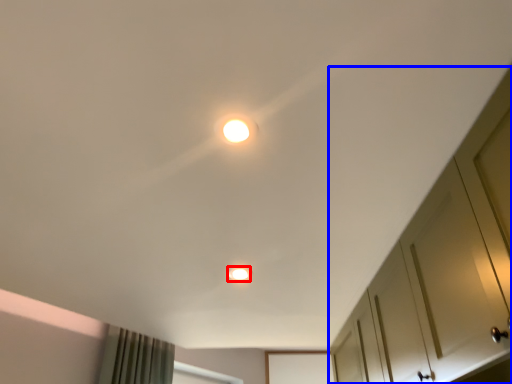
Question: Which object appears closest to the camera in this image, dot (highlighted by a red box) or dresser (highlighted by a blue box)?

Choices:
 (A) dot
 (B) dresser

Answer: (B)